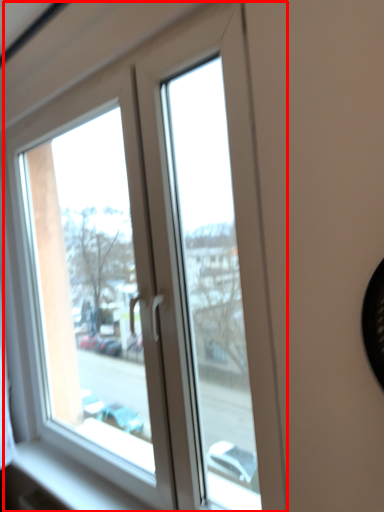
Question: From the image's perspective, where is window (annotated by the red box) located in relation to window sill in the image?

Choices:
 (A) above
 (B) below

Answer: (A)